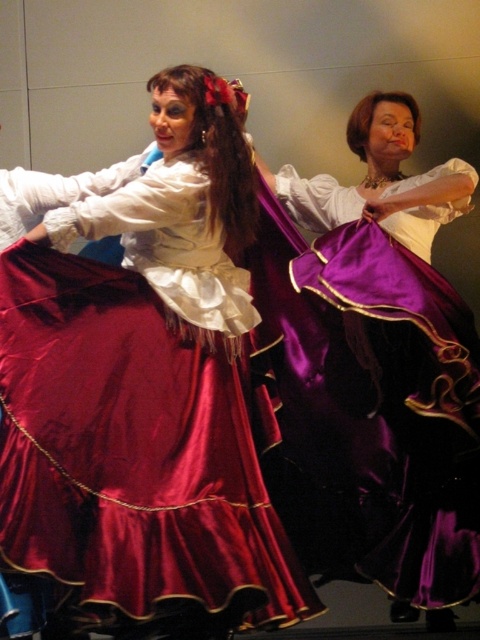
Does satin dress at center appear on the right side of satin purple dress at center?

No, satin dress at center is not to the right of satin purple dress at center.

Is point (165, 524) more distant than point (445, 209)?

No, it is in front of (445, 209).

What do you see at coordinates (144, 390) in the screenshot?
I see `satin dress at center` at bounding box center [144, 390].

Identify the location of satin dress at center. (144, 390).